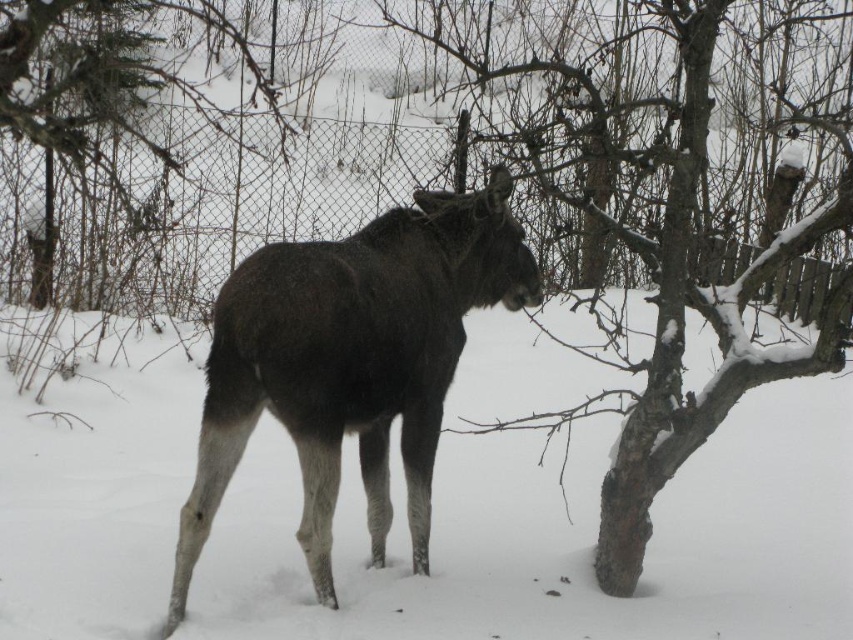
Question: Which point is closer to the camera taking this photo?

Choices:
 (A) (291, 132)
 (B) (793, 273)
 (C) (415, 264)

Answer: (C)

Question: Is wire mesh fence at center positioned before snow-covered bark tree at left?

Choices:
 (A) no
 (B) yes

Answer: (A)

Question: Is the position of dark brown fur donkey at center less distant than that of snow-covered bark tree at left?

Choices:
 (A) no
 (B) yes

Answer: (A)

Question: Which of the following is the closest to the observer?

Choices:
 (A) dark brown fur donkey at center
 (B) snow-covered bark tree at left

Answer: (B)

Question: Where is wire mesh fence at center located in relation to snow-covered bark tree at left in the image?

Choices:
 (A) right
 (B) left

Answer: (B)

Question: Which of the following is the farthest from the observer?

Choices:
 (A) (218, 449)
 (B) (120, 22)

Answer: (B)